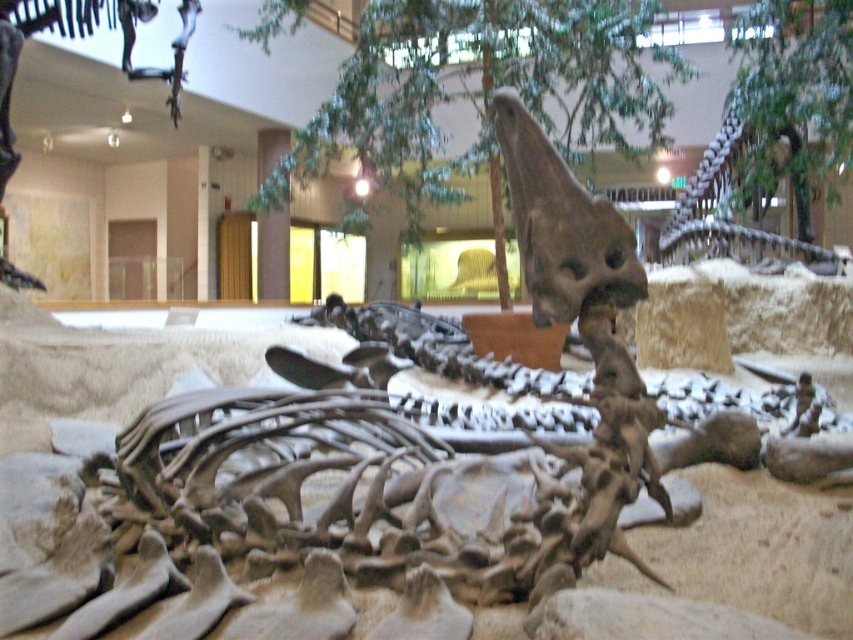
Question: Where is gray bone-like skull at center located in relation to matte gray dinosaur skeleton at upper left in the image?

Choices:
 (A) left
 (B) right

Answer: (B)

Question: Based on their relative distances, which object is farther from the gray bone-like skull at center?

Choices:
 (A) gray bone-like dinosaur at upper right
 (B) matte gray dinosaur skeleton at upper left

Answer: (A)

Question: Does gray bone-like skull at center have a lesser width compared to gray bone-like dinosaur at upper right?

Choices:
 (A) yes
 (B) no

Answer: (A)

Question: Estimate the real-world distances between objects in this image. Which object is farther from the matte gray dinosaur skeleton at upper left?

Choices:
 (A) gray bone-like dinosaur at upper right
 (B) gray bone-like skull at center

Answer: (A)

Question: Does matte gray dinosaur skeleton at upper left come in front of gray bone-like dinosaur at upper right?

Choices:
 (A) yes
 (B) no

Answer: (A)

Question: Which of the following is the closest to the observer?

Choices:
 (A) gray bone-like dinosaur at upper right
 (B) matte gray dinosaur skeleton at upper left

Answer: (B)